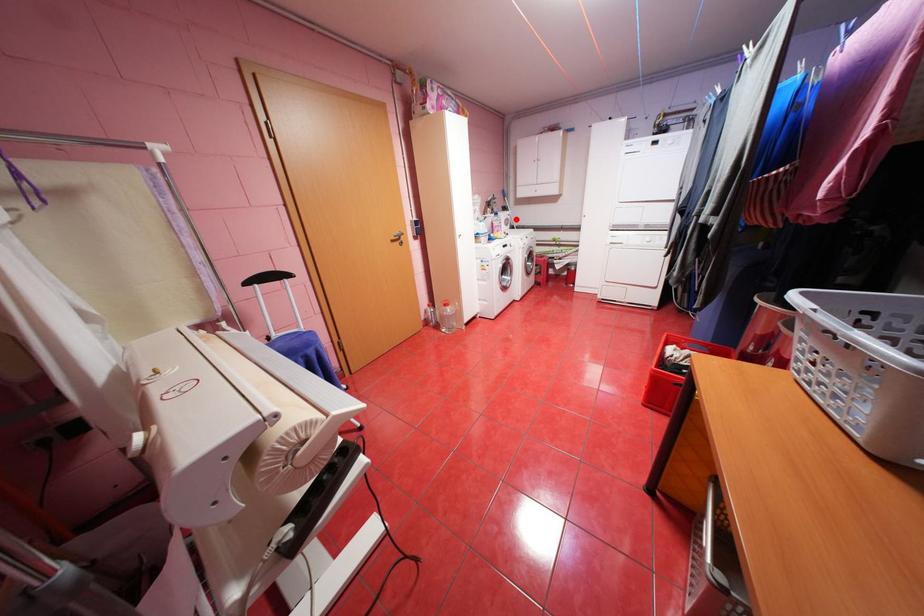
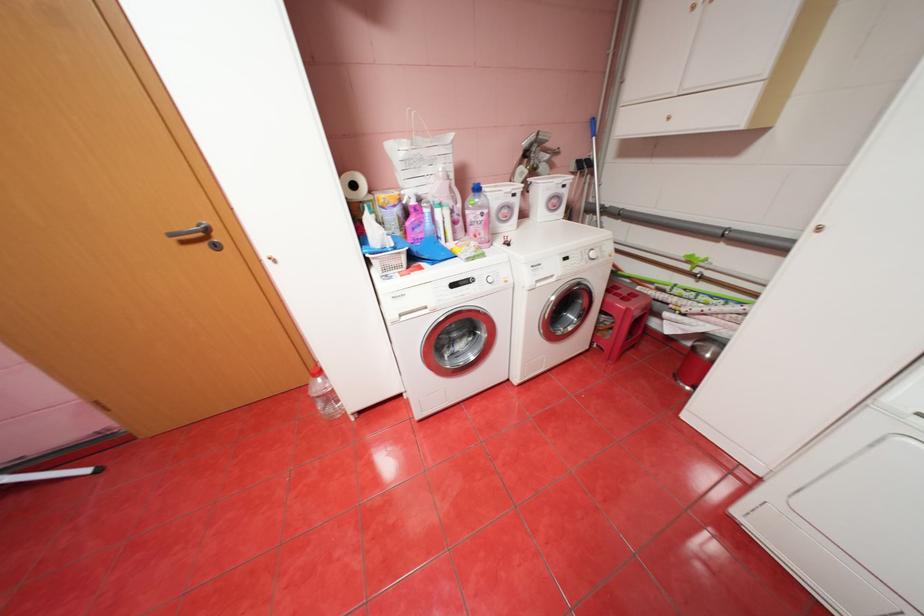
Where in the second image is the point corresponding to the highlighted location from the first image?

(566, 197)